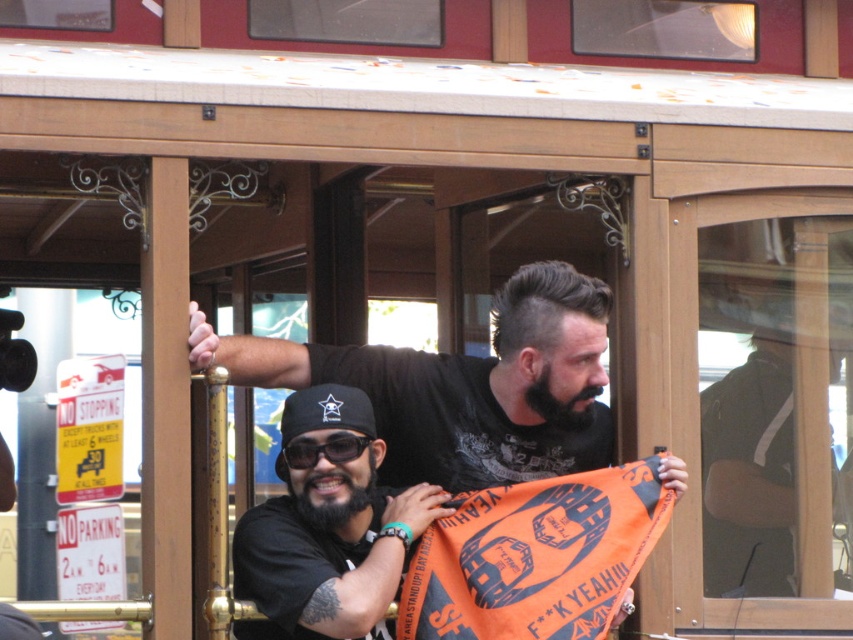
Is black matte shirt at center to the left of gold polished metal pole at center from the viewer's perspective?

No, black matte shirt at center is not to the left of gold polished metal pole at center.

Does black matte shirt at center have a smaller size compared to gold polished metal pole at center?

Actually, black matte shirt at center might be larger than gold polished metal pole at center.

Is point (526, 323) positioned after point (218, 484)?

That is True.

What are the coordinates of `black matte shirt at center` in the screenshot? It's located at (463, 385).

Is orange fabric flag at center below gold polished metal pole at center?

Yes.

Based on the photo, can you confirm if orange fabric flag at center is bigger than gold polished metal pole at center?

Yes, orange fabric flag at center is bigger than gold polished metal pole at center.

Is point (409, 636) positioned behind point (224, 484)?

Yes, it is behind point (224, 484).

This screenshot has width=853, height=640. What are the coordinates of `orange fabric flag at center` in the screenshot? It's located at (535, 556).

Is gold polished metal pole at center taller than black matte sunglasses at center?

Indeed, gold polished metal pole at center has a greater height compared to black matte sunglasses at center.

Can you confirm if gold polished metal pole at center is shorter than black matte sunglasses at center?

No, gold polished metal pole at center is not shorter than black matte sunglasses at center.

Based on the photo, who is more forward, (223, 572) or (299, 451)?

Point (223, 572) is in front.

This screenshot has width=853, height=640. What are the coordinates of `gold polished metal pole at center` in the screenshot? It's located at (218, 506).